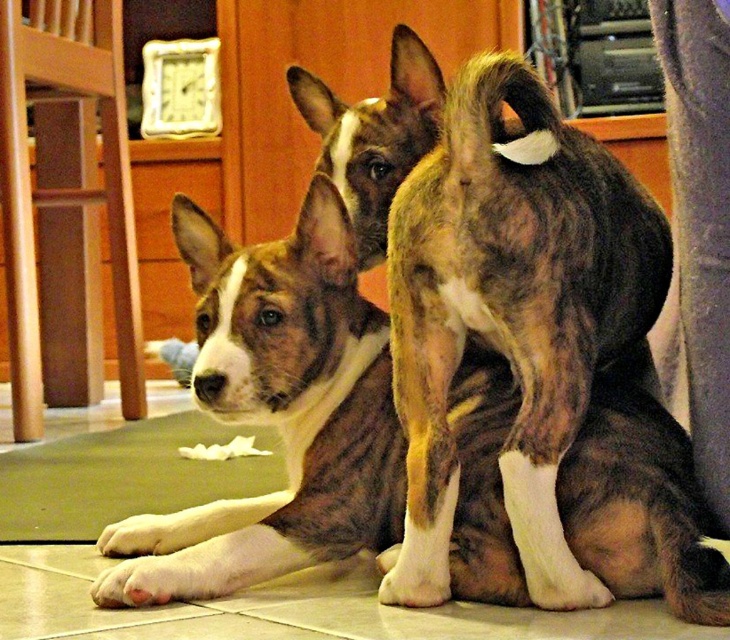
Is brown brindle coat at center bigger than green fabric mat at lower left?

Yes, brown brindle coat at center is bigger than green fabric mat at lower left.

Between point (564, 403) and point (223, 436), which one is positioned behind?

Point (223, 436)

Describe the element at coordinates (491, 284) in the screenshot. This screenshot has width=730, height=640. I see `brown brindle coat at center` at that location.

You are a GUI agent. You are given a task and a screenshot of the screen. Output one action in this format:
    pyautogui.click(x=<x>, y=<y>)
    Task: Click on the brown brindle coat at center
    This screenshot has height=640, width=730.
    Given the screenshot: What is the action you would take?
    pyautogui.click(x=491, y=284)

Between brown brindle fur at center and brown brindle coat at center, which one has less height?

brown brindle fur at center

Between point (472, 509) and point (569, 588), which one is positioned in front?

Point (569, 588) is more forward.

The image size is (730, 640). Identify the location of brown brindle fur at center. (276, 412).

Between point (691, 563) and point (77, 512), which one is positioned in front?

Point (691, 563)

Is brown brindle fur at center to the left of green fabric mat at lower left from the viewer's perspective?

No, brown brindle fur at center is not to the left of green fabric mat at lower left.

Is point (320, 397) positioned after point (118, 492)?

No, (320, 397) is in front of (118, 492).

At what (x,y) coordinates should I click in order to perform the action: click on brown brindle fur at center. Please return your answer as a coordinate pair (x, y). Looking at the image, I should click on [x=276, y=412].